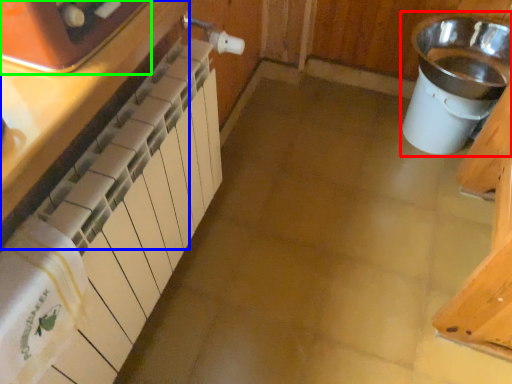
Question: Which is farther away from sink (highlighted by a red box)? cabinetry (highlighted by a blue box) or home appliance (highlighted by a green box)?

Choices:
 (A) cabinetry
 (B) home appliance

Answer: (B)